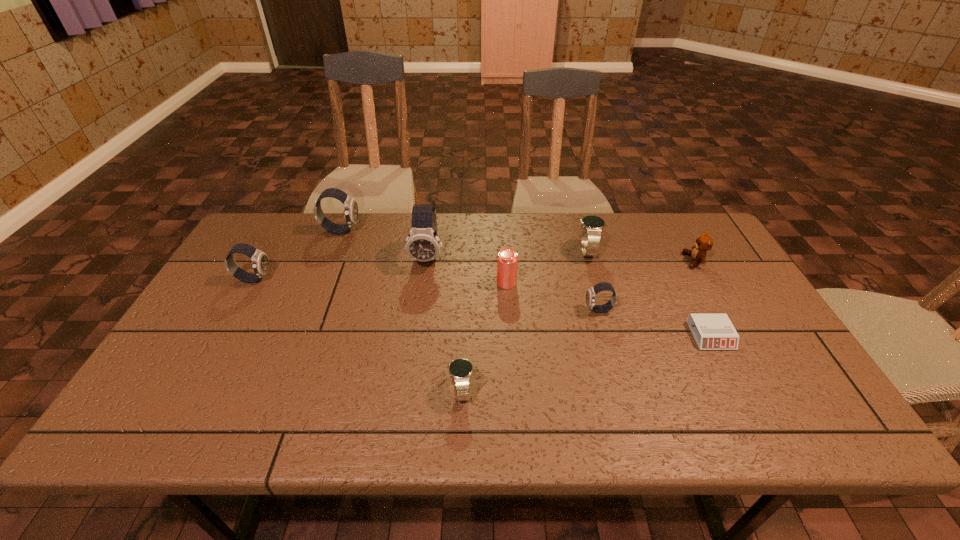
In order to click on object located at the near edge in this screenshot , I will do `click(460, 370)`.

Where is `object at the left edge`? object at the left edge is located at coordinates (260, 262).

This screenshot has height=540, width=960. I want to click on teddy bear located in the right edge section of the desktop, so click(704, 243).

Find the location of a particular element. This screenshot has height=540, width=960. alarm clock at the right edge is located at coordinates (711, 331).

This screenshot has height=540, width=960. Find the location of `object that is at the far right corner`. object that is at the far right corner is located at coordinates (704, 243).

In the image, there is a desktop. What are the coordinates of `blank space at the far edge` in the screenshot? It's located at (398, 241).

The width and height of the screenshot is (960, 540). I want to click on free point at the near edge, so click(525, 419).

I want to click on free space at the left edge of the desktop, so click(x=238, y=338).

At what (x,y) coordinates should I click in order to perform the action: click on free space at the far left corner of the desktop. Please return your answer as a coordinate pair (x, y). Looking at the image, I should click on (303, 217).

Locate an element on the screen. free point at the far right corner is located at coordinates (694, 234).